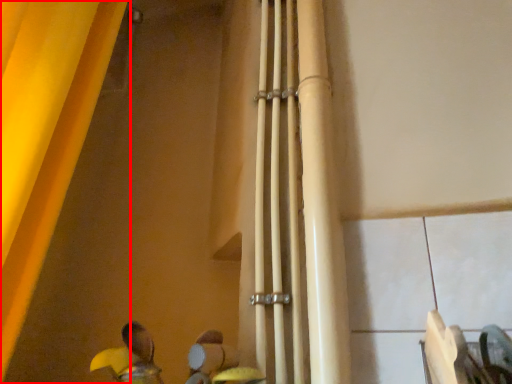
Question: In this image, where is curtain (annotated by the red box) located relative to beam?

Choices:
 (A) right
 (B) left

Answer: (B)